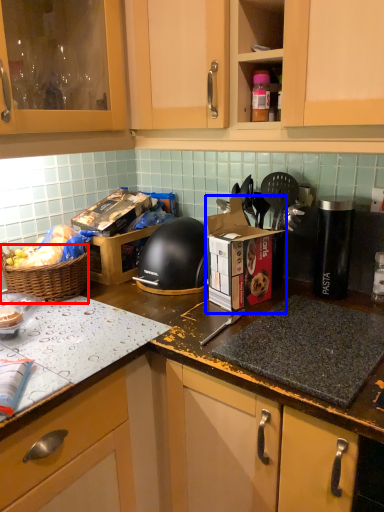
Question: Which object appears closest to the camera in this image, picnic basket (highlighted by a red box) or cardboard box (highlighted by a blue box)?

Choices:
 (A) picnic basket
 (B) cardboard box

Answer: (B)